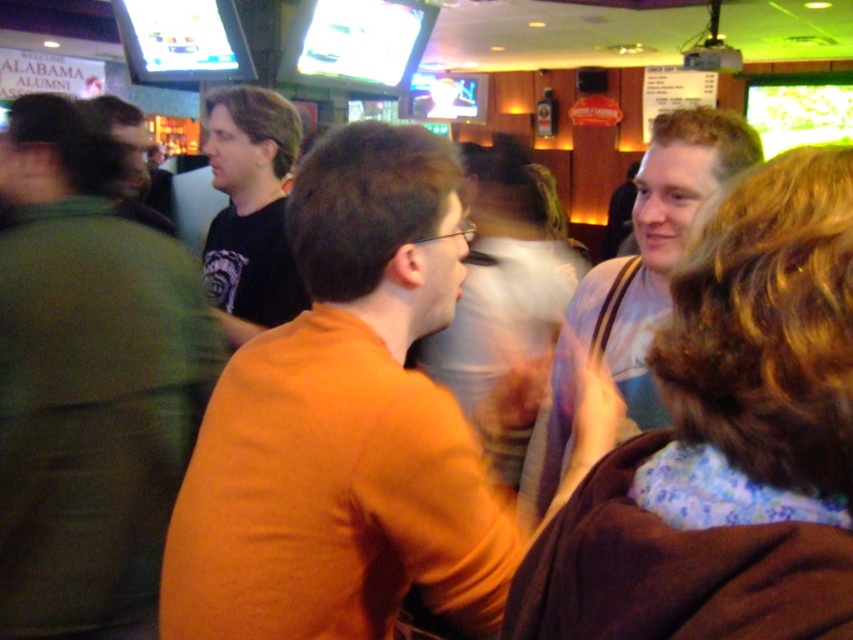
Who is shorter, orange matte shirt at center or floral fabric dress at center?

With less height is orange matte shirt at center.

Between point (213, 404) and point (486, 257), which one is positioned behind?

Positioned behind is point (486, 257).

This screenshot has width=853, height=640. What do you see at coordinates (345, 426) in the screenshot? I see `orange matte shirt at center` at bounding box center [345, 426].

You are a GUI agent. You are given a task and a screenshot of the screen. Output one action in this format:
    pyautogui.click(x=<x>, y=<y>)
    Task: Click on the orange matte shirt at center
    The height and width of the screenshot is (640, 853).
    Given the screenshot: What is the action you would take?
    pyautogui.click(x=345, y=426)

Which is more to the right, floral fabric dress at center or white cotton shirt at upper right?

white cotton shirt at upper right is more to the right.

Is point (544, 365) farther from viewer compared to point (618, 364)?

Yes.

In order to click on floral fabric dress at center in this screenshot , I will do `click(505, 301)`.

Does point (112, 595) come farther from viewer compared to point (659, 307)?

Yes.

Is point (1, 344) less distant than point (697, 176)?

That is False.

You are a GUI agent. You are given a task and a screenshot of the screen. Output one action in this format:
    pyautogui.click(x=<x>, y=<y>)
    Task: Click on the green cotton shirt at left
    Image resolution: width=853 pixels, height=640 pixels.
    Given the screenshot: What is the action you would take?
    pyautogui.click(x=88, y=381)